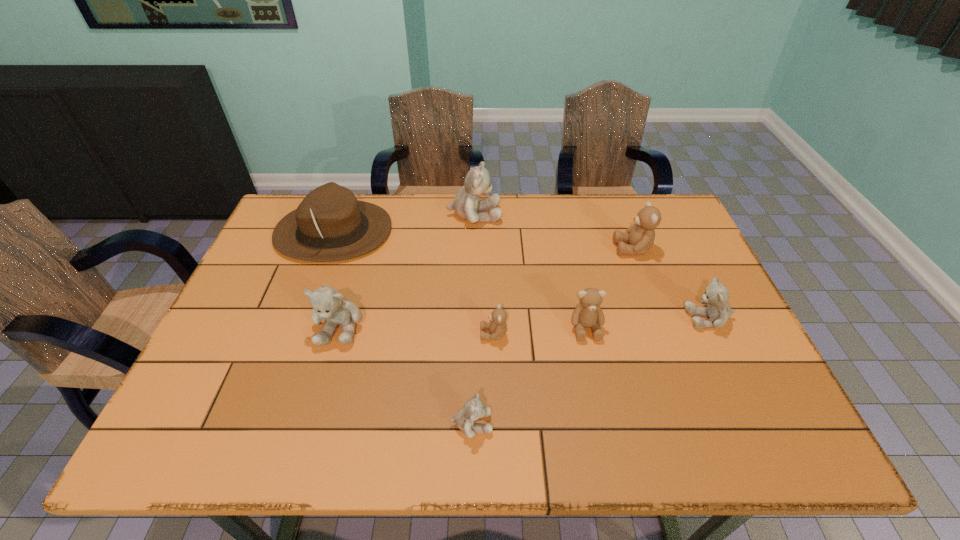
Identify the location of free space between the leftmost teddy bear and the rightmost object. Image resolution: width=960 pixels, height=540 pixels. (524, 322).

The image size is (960, 540). I want to click on free area in between the third object from right to left and the rightmost teddy bear, so click(647, 323).

This screenshot has height=540, width=960. In order to click on free space between the fedora and the second biggest brown teddy bear in this screenshot , I will do `click(460, 280)`.

Identify the location of vacant area that lies between the nearest gray teddy bear and the leftmost brown teddy bear. The image size is (960, 540). (482, 379).

Locate an element on the screen. free space that is in between the leftmost brown teddy bear and the biggest gray teddy bear is located at coordinates (484, 274).

The height and width of the screenshot is (540, 960). What are the coordinates of `free space between the sixth teddy bear from left to right and the leftmost teddy bear` in the screenshot? It's located at (486, 287).

Identify which object is located as the sixth nearest to the fedora. Please provide its 2D coordinates. Your answer should be formatted as a tuple, i.e. [(x, y)], where the tuple contains the x and y coordinates of a point satisfying the conditions above.

[(640, 236)]

The image size is (960, 540). I want to click on object that is the fourth closest to the fedora, so click(x=473, y=409).

Identify which teddy bear is the second nearest to the sixth teddy bear from left to right. Please provide its 2D coordinates. Your answer should be formatted as a tuple, i.e. [(x, y)], where the tuple contains the x and y coordinates of a point satisfying the conditions above.

[(588, 314)]

Identify which teddy bear is the fifth nearest to the leftmost gray teddy bear. Please provide its 2D coordinates. Your answer should be formatted as a tuple, i.e. [(x, y)], where the tuple contains the x and y coordinates of a point satisfying the conditions above.

[(640, 236)]